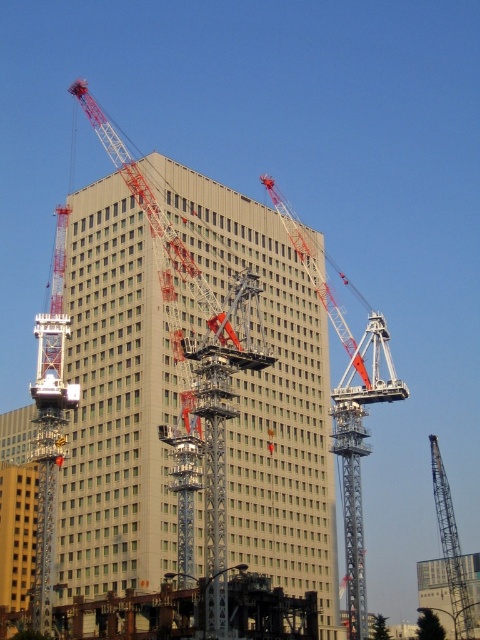
Is metallic gray crane at right above metallic gray crane at center?

Correct, metallic gray crane at right is located above metallic gray crane at center.

Which is more to the left, metallic gray crane at right or metallic gray crane at center?

metallic gray crane at center

Find the location of a particular element. metallic gray crane at right is located at coordinates (451, 545).

Locate an element on the screen. metallic gray crane at right is located at coordinates (451, 545).

Is gray concrete building at center to the right of metallic gray crane at right from the viewer's perspective?

Incorrect, gray concrete building at center is not on the right side of metallic gray crane at right.

Which is more to the left, gray concrete building at center or metallic gray crane at right?

gray concrete building at center

Image resolution: width=480 pixels, height=640 pixels. What do you see at coordinates (116, 404) in the screenshot? I see `gray concrete building at center` at bounding box center [116, 404].

Find the location of a particular element. Image resolution: width=480 pixels, height=640 pixels. gray concrete building at center is located at coordinates (116, 404).

Does gray concrete building at center have a greater width compared to metallic red crane at center?

Correct, the width of gray concrete building at center exceeds that of metallic red crane at center.

Is point (278, 232) less distant than point (348, 340)?

Yes, point (278, 232) is in front of point (348, 340).

At what (x,y) coordinates should I click in order to perform the action: click on gray concrete building at center. Please return your answer as a coordinate pair (x, y). Looking at the image, I should click on (116, 404).

At what (x,y) coordinates should I click in order to perform the action: click on gray concrete building at center. Please return your answer as a coordinate pair (x, y). This screenshot has width=480, height=640. Looking at the image, I should click on (116, 404).